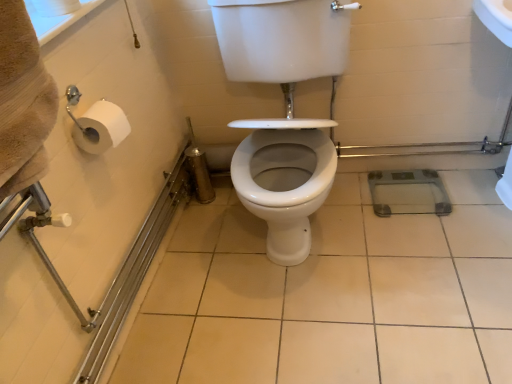
Question: Is white glossy toilet seat at center next to white glossy ceramic tile at center?

Choices:
 (A) yes
 (B) no

Answer: (B)

Question: Can you confirm if white glossy toilet seat at center is positioned to the left of white glossy ceramic tile at center?

Choices:
 (A) yes
 (B) no

Answer: (A)

Question: Is white glossy toilet seat at center behind white glossy ceramic tile at center?

Choices:
 (A) yes
 (B) no

Answer: (B)

Question: Is white glossy toilet seat at center outside white glossy ceramic tile at center?

Choices:
 (A) no
 (B) yes

Answer: (B)

Question: Does white glossy toilet seat at center have a greater height compared to white glossy ceramic tile at center?

Choices:
 (A) yes
 (B) no

Answer: (A)

Question: From a real-world perspective, is white glossy toilet seat at center on white glossy ceramic tile at center?

Choices:
 (A) no
 (B) yes

Answer: (B)

Question: Does white glossy ceramic tile at center have a greater width compared to white glossy toilet seat at center?

Choices:
 (A) yes
 (B) no

Answer: (A)

Question: Does white glossy ceramic tile at center lie in front of white glossy toilet seat at center?

Choices:
 (A) no
 (B) yes

Answer: (A)

Question: Does white glossy ceramic tile at center have a smaller size compared to white glossy toilet seat at center?

Choices:
 (A) no
 (B) yes

Answer: (B)

Question: From a real-world perspective, is white glossy ceramic tile at center under white glossy toilet seat at center?

Choices:
 (A) no
 (B) yes

Answer: (B)

Question: Does white glossy ceramic tile at center have a greater height compared to white glossy toilet seat at center?

Choices:
 (A) yes
 (B) no

Answer: (B)

Question: From the image's perspective, does white glossy ceramic tile at center appear higher than white glossy toilet seat at center?

Choices:
 (A) no
 (B) yes

Answer: (A)

Question: Visually, is white glossy toilet seat at center positioned to the left or to the right of white glossy ceramic tile at center?

Choices:
 (A) right
 (B) left

Answer: (B)